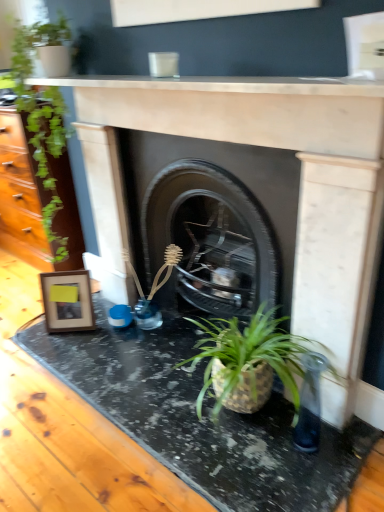
Describe the element at coordinates (226, 85) in the screenshot. I see `white marble fireplace at upper center, acting as the 1th counter top starting from the top` at that location.

Measure the distance between black marble counter top at lower center, which is the 1th counter top in bottom-to-top order, and camera.

The distance of black marble counter top at lower center, which is the 1th counter top in bottom-to-top order, from camera is 4.05 feet.

What is the approximate width of black marble fireplace at center, placed as the first fireplace when sorted from back to front?

black marble fireplace at center, placed as the first fireplace when sorted from back to front, is 11.89 inches in width.

Image resolution: width=384 pixels, height=512 pixels. I want to click on black marble fireplace at center, the 2th fireplace from the front, so point(213,219).

Locate an element on the screen. The image size is (384, 512). green leafy plant at left is located at coordinates (39, 166).

From a real-world perspective, does black marble counter top at lower center, which is the second counter top from top to bottom, stand above wooden photo frame at left?

Incorrect, from a real-world perspective, black marble counter top at lower center, which is the second counter top from top to bottom, is lower than wooden photo frame at left.

Is black marble counter top at lower center, which is the 1th counter top in bottom-to-top order, not near wooden photo frame at left?

No.

From the picture: Is black marble counter top at lower center, which is the 1th counter top in bottom-to-top order, oriented towards wooden photo frame at left?

No.

Does point (132, 432) appear closer or farther from the camera than point (44, 309)?

Point (132, 432).

Is green leafy plant at left oriented away from white marble fireplace at upper center, acting as the 1th counter top starting from the top?

green leafy plant at left does not have its back to white marble fireplace at upper center, acting as the 1th counter top starting from the top.

From the image's perspective, is green leafy plant at left below white marble fireplace at upper center, which is counted as the 2th counter top, starting from the bottom?

Yes, from the image's perspective, green leafy plant at left is below white marble fireplace at upper center, which is counted as the 2th counter top, starting from the bottom.

What's the angular difference between green leafy plant at left and white marble fireplace at upper center, acting as the 1th counter top starting from the top,'s facing directions?

They differ by 2.3 degrees in their facing directions.

Can you confirm if green leafy plant at left is bigger than white marble fireplace at upper center, acting as the 1th counter top starting from the top?

Correct, green leafy plant at left is larger in size than white marble fireplace at upper center, acting as the 1th counter top starting from the top.

Does green leafy plant at left appear on the right side of black marble fireplace at center, the 2th fireplace from the front?

No, green leafy plant at left is not to the right of black marble fireplace at center, the 2th fireplace from the front.

Considering the sizes of green leafy plant at left and black marble fireplace at center, placed as the first fireplace when sorted from back to front, in the image, is green leafy plant at left bigger or smaller than black marble fireplace at center, placed as the first fireplace when sorted from back to front,?

In the image, green leafy plant at left appears to be smaller than black marble fireplace at center, placed as the first fireplace when sorted from back to front.

From the image's perspective, which object appears higher, green leafy plant at left or black marble fireplace at center, the 2th fireplace from the front?

green leafy plant at left is shown above in the image.

You are a GUI agent. You are given a task and a screenshot of the screen. Output one action in this format:
    pyautogui.click(x=<x>, y=<y>)
    Task: Click on the counter top below the black marble fireplace at center, placed as the first fireplace when sorted from back to front (from the image's perspective)
    Image resolution: width=384 pixels, height=512 pixels.
    Given the screenshot: What is the action you would take?
    pyautogui.click(x=201, y=420)

Consider the image. Is black marble fireplace at center, the 2th fireplace from the front, not inside black marble counter top at lower center, which is the second counter top from top to bottom?

Yes, black marble fireplace at center, the 2th fireplace from the front, is located beyond the bounds of black marble counter top at lower center, which is the second counter top from top to bottom.

Based on their positions, is black marble fireplace at center, placed as the first fireplace when sorted from back to front, located to the left or right of black marble counter top at lower center, which is the second counter top from top to bottom?

black marble fireplace at center, placed as the first fireplace when sorted from back to front, is positioned on black marble counter top at lower center, which is the second counter top from top to bottom,'s right side.

Does black marble fireplace at center, the 2th fireplace from the front, have a smaller size compared to black marble counter top at lower center, which is the 1th counter top in bottom-to-top order?

No, black marble fireplace at center, the 2th fireplace from the front, is not smaller than black marble counter top at lower center, which is the 1th counter top in bottom-to-top order.

Which is closer, (283,252) or (229,88)?

Point (283,252) appears to be farther away from the viewer than point (229,88).

Is black marble fireplace at center, placed as the first fireplace when sorted from back to front, to the right of white marble fireplace at upper center, acting as the 1th counter top starting from the top, from the viewer's perspective?

Yes.

What's the angular difference between black marble fireplace at center, placed as the first fireplace when sorted from back to front, and white marble fireplace at upper center, acting as the 1th counter top starting from the top,'s facing directions?

They differ by 1.57 degrees in their facing directions.

From the image's perspective, is white marble fireplace at upper center, acting as the 1th counter top starting from the top, located above black marble fireplace at center, the 2th fireplace from the front?

Yes, from the image's perspective, white marble fireplace at upper center, acting as the 1th counter top starting from the top, is on top of black marble fireplace at center, the 2th fireplace from the front.

Can you confirm if white marble fireplace at upper center, which is counted as the 2th counter top, starting from the bottom, is positioned to the left of black marble fireplace at center, the 2th fireplace from the front?

Yes, white marble fireplace at upper center, which is counted as the 2th counter top, starting from the bottom, is to the left of black marble fireplace at center, the 2th fireplace from the front.

From a real-world perspective, does white marble fireplace at upper center, which is counted as the 2th counter top, starting from the bottom, stand above black marble fireplace at center, placed as the first fireplace when sorted from back to front?

Yes.

Can you tell me how much white marble fireplace at upper center, acting as the 1th counter top starting from the top, and black marble fireplace at center, placed as the first fireplace when sorted from back to front, differ in facing direction?

1.57 degrees separate the facing orientations of white marble fireplace at upper center, acting as the 1th counter top starting from the top, and black marble fireplace at center, placed as the first fireplace when sorted from back to front.

Considering the relative sizes of wooden photo frame at left and black marble fireplace at center, placed as the first fireplace when sorted from back to front, in the image provided, is wooden photo frame at left thinner than black marble fireplace at center, placed as the first fireplace when sorted from back to front,?

Yes, wooden photo frame at left is thinner than black marble fireplace at center, placed as the first fireplace when sorted from back to front.

Where is `the 2nd fireplace counting from the right of the wooden photo frame at left`? the 2nd fireplace counting from the right of the wooden photo frame at left is located at coordinates (213, 219).

Which is closer to the camera, (89, 304) or (207, 201)?

Point (89, 304) is farther from the camera than point (207, 201).

Considering the relative positions of wooden photo frame at left and black marble fireplace at center, the 2th fireplace from the front, in the image provided, is wooden photo frame at left to the right of black marble fireplace at center, the 2th fireplace from the front, from the viewer's perspective?

In fact, wooden photo frame at left is to the left of black marble fireplace at center, the 2th fireplace from the front.

You are a GUI agent. You are given a task and a screenshot of the screen. Output one action in this format:
    pyautogui.click(x=<x>, y=<y>)
    Task: Click on the counter top below the wooden photo frame at left (from the image's perspective)
    This screenshot has height=512, width=384.
    Given the screenshot: What is the action you would take?
    pyautogui.click(x=201, y=420)

The image size is (384, 512). In the image, there is a green leafy plant at left. Find the location of `counter top above it (from the image's perspective)`. counter top above it (from the image's perspective) is located at coordinates (226, 85).

When comparing their distances from white marble fireplace at upper center, acting as the 1th counter top starting from the top, does black marble counter top at lower center, which is the second counter top from top to bottom, or wooden photo frame at left seem closer?

wooden photo frame at left is closer to white marble fireplace at upper center, acting as the 1th counter top starting from the top.

Which object lies further to the anchor point black marble fireplace at center, placed as the first fireplace when sorted from back to front, green leafy plant at left or wooden photo frame at left?

green leafy plant at left is positioned further to the anchor black marble fireplace at center, placed as the first fireplace when sorted from back to front.

Looking at the image, which one is located closer to matte stone fireplace at center, the second fireplace positioned from the back, white marble fireplace at upper center, which is counted as the 2th counter top, starting from the bottom, or wooden photo frame at left?

white marble fireplace at upper center, which is counted as the 2th counter top, starting from the bottom, lies closer to matte stone fireplace at center, the second fireplace positioned from the back, than the other object.

Considering their positions, is black marble fireplace at center, placed as the first fireplace when sorted from back to front, positioned closer to green leafy plant at left than matte stone fireplace at center, the second fireplace positioned from the back?

matte stone fireplace at center, the second fireplace positioned from the back, is positioned closer to the anchor green leafy plant at left.

Based on their spatial positions, is black marble counter top at lower center, which is the second counter top from top to bottom, or wooden photo frame at left closer to black marble fireplace at center, placed as the first fireplace when sorted from back to front?

Among the two, black marble counter top at lower center, which is the second counter top from top to bottom, is located nearer to black marble fireplace at center, placed as the first fireplace when sorted from back to front.

From the image, which object appears to be nearer to green leafy plant at left, black marble fireplace at center, placed as the first fireplace when sorted from back to front, or wooden photo frame at left?

wooden photo frame at left lies closer to green leafy plant at left than the other object.

When comparing their distances from green leafy plant at left, does black marble counter top at lower center, which is the 1th counter top in bottom-to-top order, or matte stone fireplace at center, the second fireplace positioned from the back, seem further?

black marble counter top at lower center, which is the 1th counter top in bottom-to-top order, is further to green leafy plant at left.

Looking at the image, which one is located further to matte stone fireplace at center, the second fireplace positioned from the back, green leafy plant at left or black marble counter top at lower center, which is the 1th counter top in bottom-to-top order?

The object further to matte stone fireplace at center, the second fireplace positioned from the back, is green leafy plant at left.

Find the location of a particular element. This screenshot has height=512, width=384. fireplace located between matte stone fireplace at center, which ranks as the first fireplace in front-to-back order, and wooden photo frame at left in the depth direction is located at coordinates (213, 219).

The width and height of the screenshot is (384, 512). In order to click on fireplace between white marble fireplace at upper center, acting as the 1th counter top starting from the top, and matte stone fireplace at center, which ranks as the first fireplace in front-to-back order, vertically in this screenshot , I will do `click(213, 219)`.

In order to click on houseplant between matte stone fireplace at center, the second fireplace positioned from the back, and wooden photo frame at left, along the z-axis in this screenshot , I will do `click(39, 166)`.

This screenshot has height=512, width=384. I want to click on fireplace between green leafy plant at left and black marble fireplace at center, placed as the first fireplace when sorted from back to front, from left to right, so click(x=300, y=189).